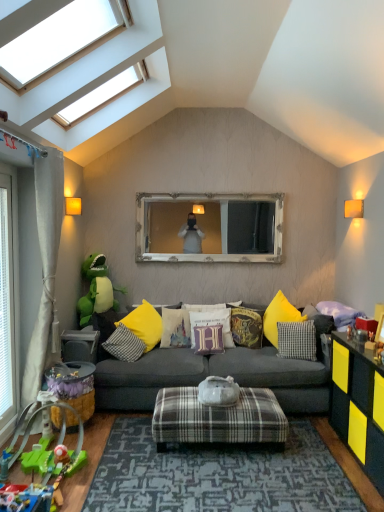
Describe the element at coordinates (209, 228) in the screenshot. The image size is (384, 512). I see `wooden framed mirror at center` at that location.

Describe the element at coordinates (74, 386) in the screenshot. The width and height of the screenshot is (384, 512). I see `plush fabric toy at lower left, the 3th toy when ordered from front to back` at that location.

Where is `white cotton pillow at center, which appears as the 5th pillow when viewed from the right`? The width and height of the screenshot is (384, 512). white cotton pillow at center, which appears as the 5th pillow when viewed from the right is located at coordinates (175, 328).

The width and height of the screenshot is (384, 512). Identify the location of velvet harry potter-themed pillow at center, the 5th pillow from the left. (247, 327).

Is transparent glass door at left taller or shorter than velvet purple pillow at center, which is the 4th pillow from left to right?

Clearly, transparent glass door at left is taller compared to velvet purple pillow at center, which is the 4th pillow from left to right.

Considering their positions, is transparent glass door at left located in front of or behind velvet purple pillow at center, which is the 4th pillow from left to right?

transparent glass door at left is positioned closer to the viewer than velvet purple pillow at center, which is the 4th pillow from left to right.

Is velvet purple pillow at center, which is the 4th pillow from left to right, inside transparent glass door at left?

Actually, velvet purple pillow at center, which is the 4th pillow from left to right, is outside transparent glass door at left.

Considering the sizes of objects transparent glass door at left and velvet purple pillow at center, which is the 4th pillow from left to right, in the image provided, who is smaller, transparent glass door at left or velvet purple pillow at center, which is the 4th pillow from left to right,?

Smaller between the two is transparent glass door at left.

In the scene shown: From their relative heights in the image, would you say yellow fabric pillow at center, which appears as the first pillow when viewed from the left, is taller or shorter than transparent glass skylight at upper left?

yellow fabric pillow at center, which appears as the first pillow when viewed from the left, is shorter than transparent glass skylight at upper left.

Considering the sizes of objects yellow fabric pillow at center, which appears as the first pillow when viewed from the left, and transparent glass skylight at upper left in the image provided, who is thinner, yellow fabric pillow at center, which appears as the first pillow when viewed from the left, or transparent glass skylight at upper left?

yellow fabric pillow at center, which appears as the first pillow when viewed from the left, is thinner.

Visually, is yellow fabric pillow at center, which is counted as the 6th pillow, starting from the right, positioned to the left or to the right of transparent glass skylight at upper left?

In the image, yellow fabric pillow at center, which is counted as the 6th pillow, starting from the right, appears on the right side of transparent glass skylight at upper left.

From the image's perspective, is green plastic toy at lower left, the third toy positioned from the back, below velvet purple pillow at center, arranged as the third pillow when viewed from the right?

Yes.

What's the angular difference between green plastic toy at lower left, the third toy positioned from the back, and velvet purple pillow at center, arranged as the third pillow when viewed from the right,'s facing directions?

The angle between the facing direction of green plastic toy at lower left, the third toy positioned from the back, and the facing direction of velvet purple pillow at center, arranged as the third pillow when viewed from the right, is 89 degrees.

Would you say green plastic toy at lower left, the third toy positioned from the back, is to the left or to the right of velvet purple pillow at center, which is the 4th pillow from left to right, in the picture?

From the image, it's evident that green plastic toy at lower left, the third toy positioned from the back, is to the left of velvet purple pillow at center, which is the 4th pillow from left to right.

Does white cotton pillow at center, acting as the 2th pillow starting from the left, have a smaller size compared to wooden framed mirror at center?

Indeed, white cotton pillow at center, acting as the 2th pillow starting from the left, has a smaller size compared to wooden framed mirror at center.

I want to click on mirror behind the white cotton pillow at center, acting as the 2th pillow starting from the left, so click(209, 228).

Is white cotton pillow at center, which appears as the 5th pillow when viewed from the right, at the left side of wooden framed mirror at center?

Yes, white cotton pillow at center, which appears as the 5th pillow when viewed from the right, is to the left of wooden framed mirror at center.

In order to click on studio couch located above the matte black dresser at right (from the image's perspective) in this screenshot , I will do `click(212, 374)`.

Does point (325, 408) come behind point (358, 389)?

Yes, it is.

Considering the relative sizes of dark gray fabric couch at center and matte black dresser at right in the image provided, is dark gray fabric couch at center taller than matte black dresser at right?

Correct, dark gray fabric couch at center is much taller as matte black dresser at right.

Can you see dark gray fabric couch at center touching matte black dresser at right?

No, dark gray fabric couch at center is not making contact with matte black dresser at right.

Is transparent glass door at left not close to wooden framed mirror at center?

That's right, there is a large distance between transparent glass door at left and wooden framed mirror at center.

Does point (5, 328) lie behind point (208, 230)?

No, it is not.

Can you confirm if transparent glass door at left is thinner than wooden framed mirror at center?

Indeed, transparent glass door at left has a lesser width compared to wooden framed mirror at center.

Is transparent glass door at left taller or shorter than wooden framed mirror at center?

transparent glass door at left is taller than wooden framed mirror at center.

From the image's perspective, which one is positioned lower, green plastic toy at lower left, which ranks as the 4th toy in top-to-bottom order, or beige fabric curtain at left?

green plastic toy at lower left, which ranks as the 4th toy in top-to-bottom order, from the image's perspective.

Would you consider green plastic toy at lower left, which is the 1th toy in bottom-to-top order, to be distant from beige fabric curtain at left?

Yes, green plastic toy at lower left, which is the 1th toy in bottom-to-top order, is far from beige fabric curtain at left.

Considering the positions of objects green plastic toy at lower left, which ranks as the 4th toy in top-to-bottom order, and beige fabric curtain at left in the image provided, who is more to the left, green plastic toy at lower left, which ranks as the 4th toy in top-to-bottom order, or beige fabric curtain at left?

beige fabric curtain at left.

Relative to beige fabric curtain at left, is green plastic toy at lower left, placed as the second toy when sorted from front to back, in front or behind?

Visually, green plastic toy at lower left, placed as the second toy when sorted from front to back, is located in front of beige fabric curtain at left.

Locate an element on the screen. Image resolution: width=384 pixels, height=512 pixels. glass door above the velvet purple pillow at center, arranged as the third pillow when viewed from the right (from the image's perspective) is located at coordinates (x=9, y=303).

There is a transparent glass skylight at upper left. Where is `the 6th pillow below it (from the image's perspective)`? Image resolution: width=384 pixels, height=512 pixels. the 6th pillow below it (from the image's perspective) is located at coordinates (124, 344).

Estimate the real-world distances between objects in this image. Which object is closer to checkered fabric pillow at center, acting as the 6th pillow starting from the left, beige fabric curtain at left or plush fabric toy at lower left, the 3th toy when ordered from front to back?

plush fabric toy at lower left, the 3th toy when ordered from front to back, is closer to checkered fabric pillow at center, acting as the 6th pillow starting from the left.

From the picture: Based on their spatial positions, is velvet harry potter-themed pillow at center, the 5th pillow from the left, or velvet purple pillow at center, arranged as the third pillow when viewed from the right, further from plush fabric toy at lower left, the second toy in the bottom-to-top sequence?

velvet harry potter-themed pillow at center, the 5th pillow from the left, is further to plush fabric toy at lower left, the second toy in the bottom-to-top sequence.

Which object lies further to the anchor point wooden framed mirror at center, beige fabric curtain at left or checkered fabric pillow at center, which appears as the 1th pillow when viewed from the right?

The object further to wooden framed mirror at center is beige fabric curtain at left.

Looking at the image, which one is located further to plush fabric toy at lower left, the 3th toy when ordered from front to back, green plastic toy at lower left, placed as the second toy when sorted from front to back, or matte black dresser at right?

matte black dresser at right is further to plush fabric toy at lower left, the 3th toy when ordered from front to back.

From the picture: When comparing their distances from velvet purple pillow at center, arranged as the third pillow when viewed from the right, does plaid fabric ottoman at center or yellow fabric pillow at center, which is counted as the 6th pillow, starting from the right, seem further?

plaid fabric ottoman at center.

Considering their positions, is green plush toy at left, which is the fourth toy in bottom-to-top order, positioned closer to transparent glass skylight at upper left than matte black dresser at right?

green plush toy at left, which is the fourth toy in bottom-to-top order, is positioned closer to the anchor transparent glass skylight at upper left.

Based on their spatial positions, is green plastic toy at lower left, which is the 1th toy in bottom-to-top order, or yellow fabric pillow at center, which is counted as the 6th pillow, starting from the right, closer to velvet purple pillow at center, arranged as the third pillow when viewed from the right?

The object closer to velvet purple pillow at center, arranged as the third pillow when viewed from the right, is yellow fabric pillow at center, which is counted as the 6th pillow, starting from the right.

Which object lies nearer to the anchor point green plastic toy at lower left, the third toy positioned from the back, green plush toy at left, the first toy positioned from the top, or transparent glass door at left?

The object closer to green plastic toy at lower left, the third toy positioned from the back, is transparent glass door at left.

I want to click on glass door positioned between green plastic toy at lower left, placed as the second toy when sorted from front to back, and white cotton pillow at center, which appears as the 5th pillow when viewed from the right, from near to far, so click(9, 303).

Identify the location of studio couch between transparent glass door at left and checkered fabric pillow at center, which appears as the 1th pillow when viewed from the right, from left to right. (212, 374).

At what (x,y) coordinates should I click in order to perform the action: click on curtain situated between transparent glass door at left and purple velvet pillow at center, the 3th pillow from the left, from left to right. Please return your answer as a coordinate pair (x, y). The height and width of the screenshot is (512, 384). Looking at the image, I should click on (45, 262).

You are a GUI agent. You are given a task and a screenshot of the screen. Output one action in this format:
    pyautogui.click(x=<x>, y=<y>)
    Task: Click on the curtain located between plastic toy car at lower left, marked as the second toy in a top-to-bottom arrangement, and green plush toy at left, acting as the fourth toy starting from the front, in the depth direction
    
    Given the screenshot: What is the action you would take?
    pyautogui.click(x=45, y=262)